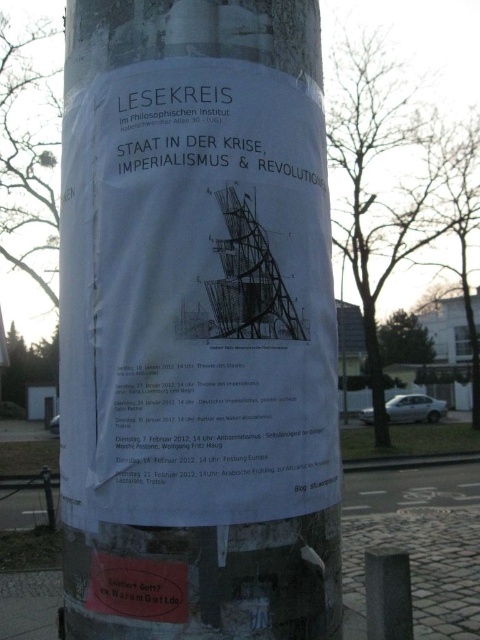
Between white paper poster at center and black stone post at lower right, which one has less height?

With less height is black stone post at lower right.

Can you confirm if white paper poster at center is shorter than black stone post at lower right?

No.

Measure the distance between point (x=250, y=244) and camera.

5.54 feet

Where is `white paper poster at center`? white paper poster at center is located at coordinates coord(195,298).